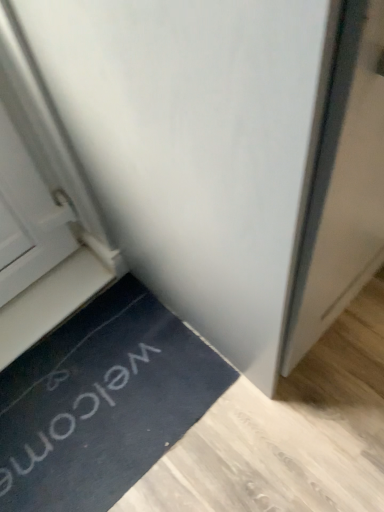
Question: Considering the positions of black rubber doormat at lower left and white matte door at center in the image, is black rubber doormat at lower left taller or shorter than white matte door at center?

Choices:
 (A) short
 (B) tall

Answer: (A)

Question: Considering the positions of point (51, 458) and point (299, 301), is point (51, 458) closer or farther from the camera than point (299, 301)?

Choices:
 (A) closer
 (B) farther

Answer: (B)

Question: Which object is the closest to the white plastic stairwell at lower left?

Choices:
 (A) black rubber doormat at lower left
 (B) white matte door at center

Answer: (A)

Question: Which of these objects is positioned closest to the white plastic stairwell at lower left?

Choices:
 (A) black rubber doormat at lower left
 (B) white matte door at center

Answer: (A)